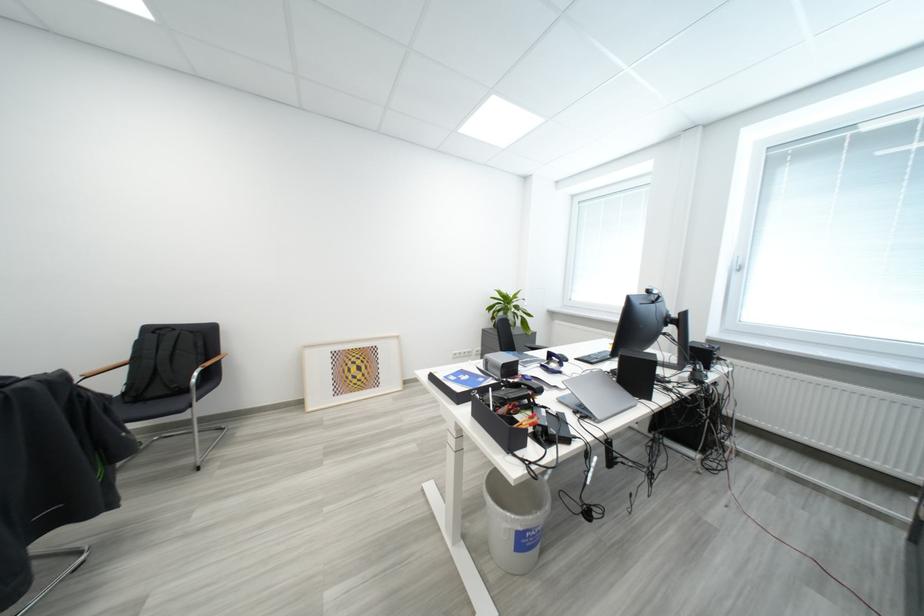
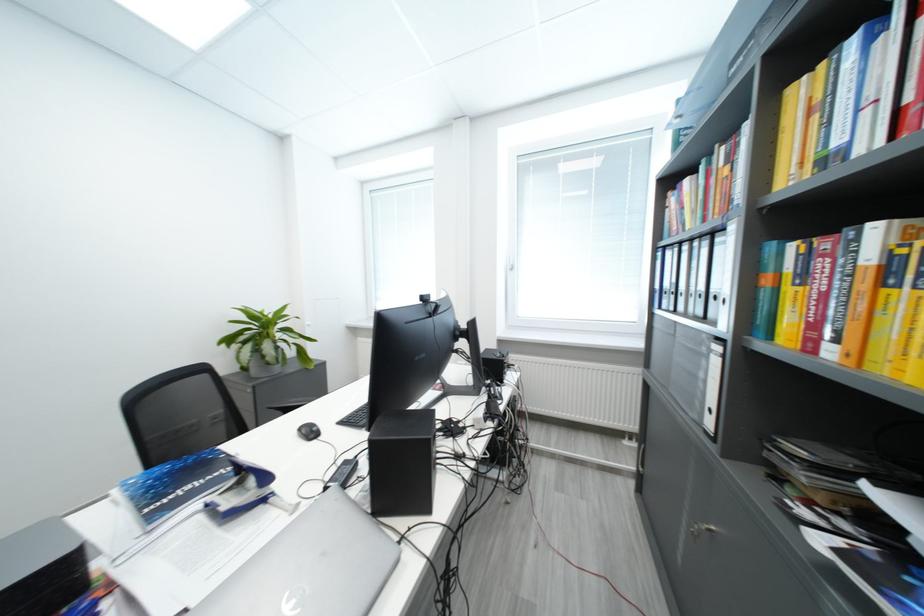
Question: The camera is either moving clockwise (left) or counter-clockwise (right) around the object. The first image is from the beginning of the video and the second image is from the end. Is the camera moving left or right when shooting the video?

Choices:
 (A) Left
 (B) Right

Answer: (A)